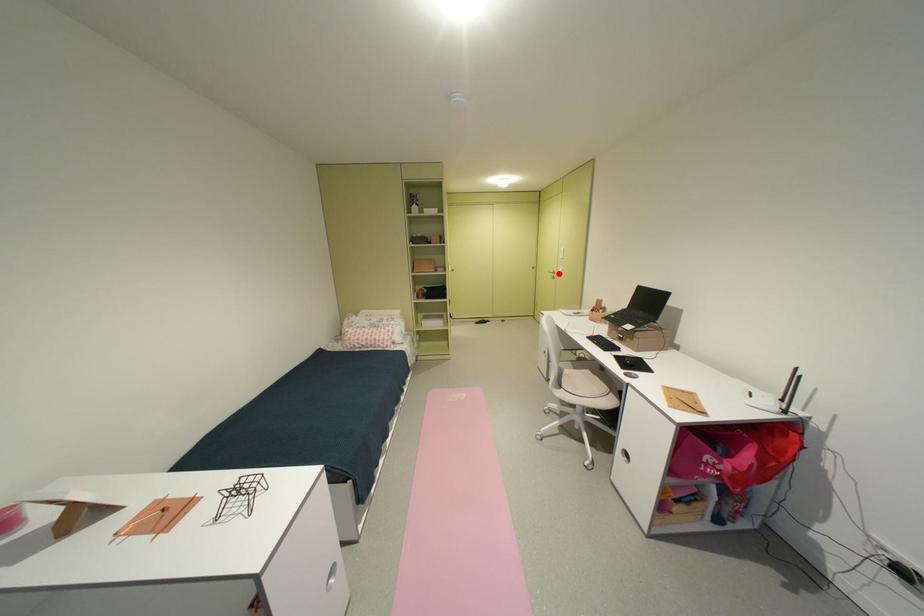
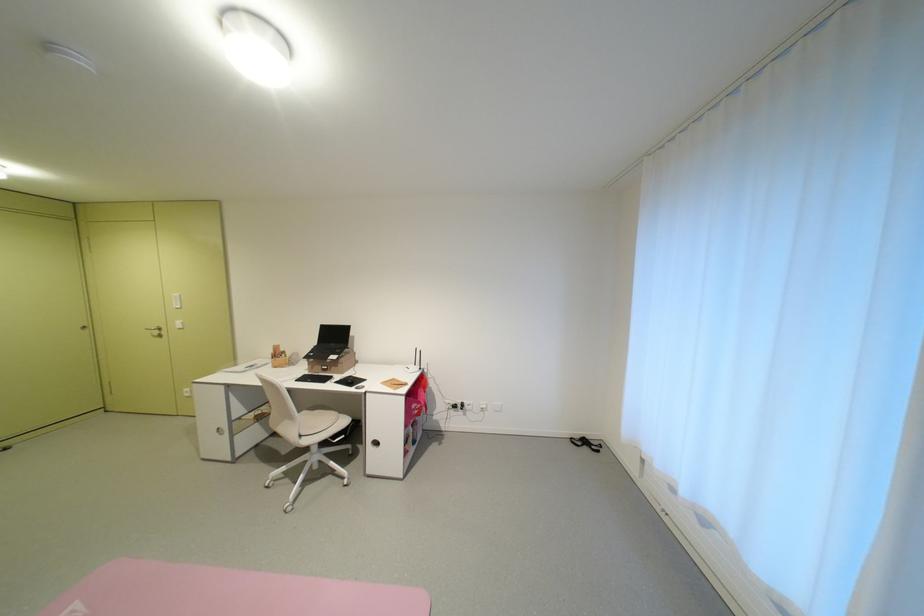
Find the pixel in the second image that matches the highlighted location in the first image.

(156, 331)